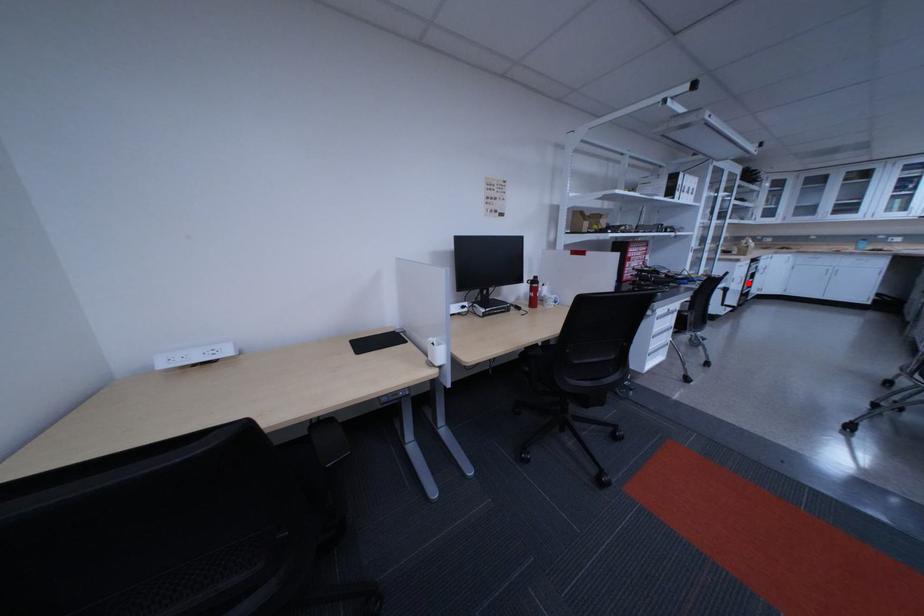
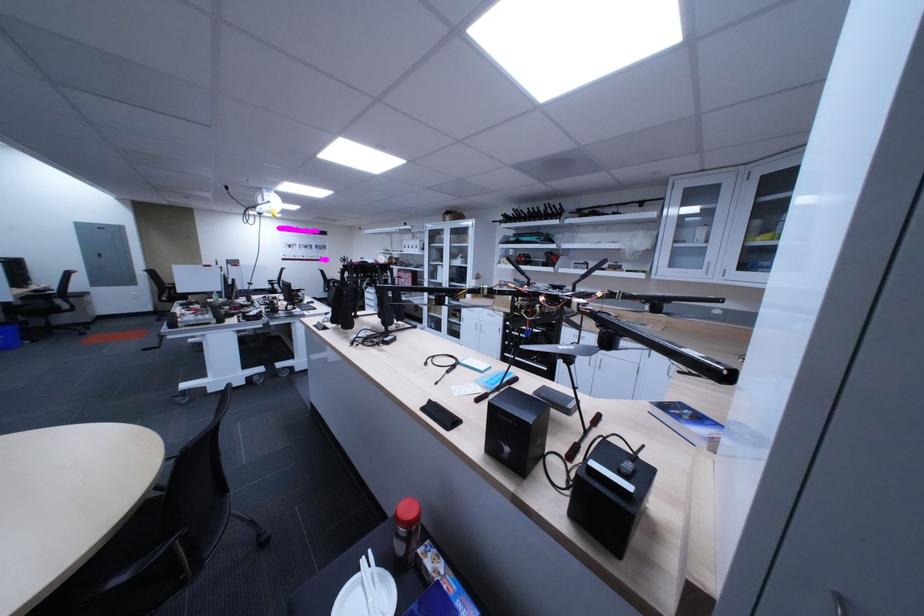
Locate, in the second image, the point that corresponds to the highlighted location in the first image.

(478, 323)